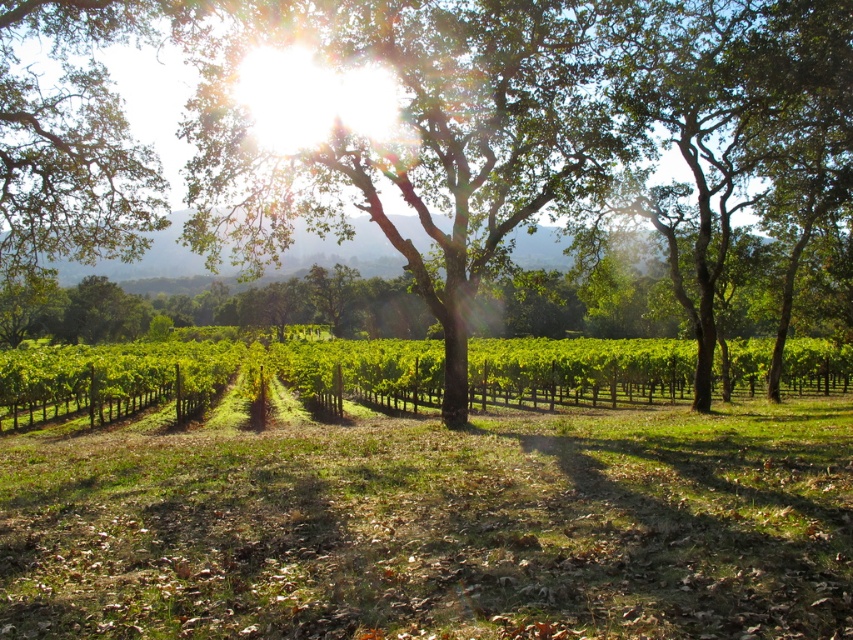
Consider the image. You are a painter standing in the vineyard and want to paint the green leafy tree at center and the green leafy vines at center. Which of the two has a wider spread?

The green leafy vines at center have a greater width than the green leafy tree at center, so the green leafy vines at center are wider.

You are a photographer standing in the vineyard and want to take a picture of the green leafy tree at center and the green leafy vines at center. Which object will appear closer to you in the photo?

The green leafy tree at center will appear closer to you in the photo because it is positioned in front of the green leafy vines at center.